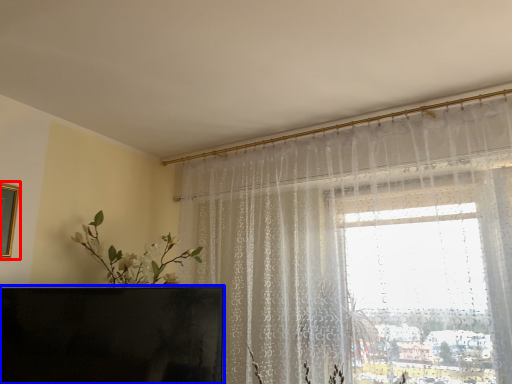
Question: Which of the following is the farthest to the observer, picture frame (highlighted by a red box) or furniture (highlighted by a blue box)?

Choices:
 (A) picture frame
 (B) furniture

Answer: (A)